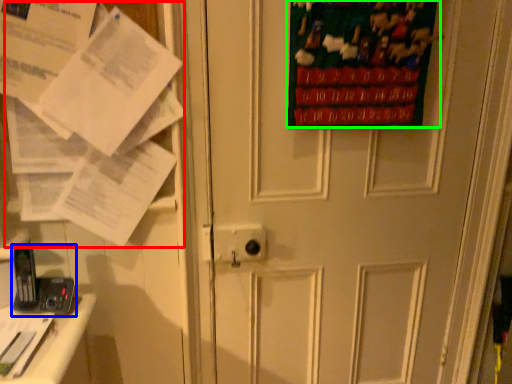
Question: Based on their relative distances, which object is farther from paper (highlighted by a red box)? Choose from equipment (highlighted by a blue box) and poster page (highlighted by a green box).

Choices:
 (A) equipment
 (B) poster page

Answer: (B)